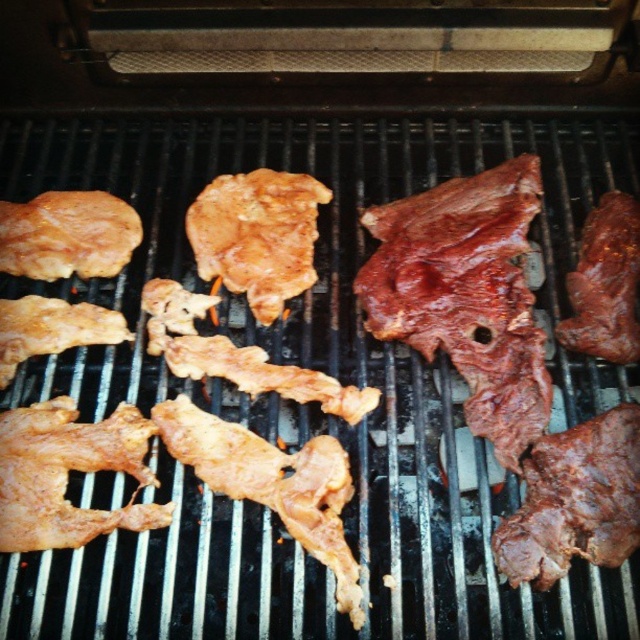
Does dark brown charred steak at right appear over brown matte chicken at center?

Actually, dark brown charred steak at right is below brown matte chicken at center.

Identify the location of dark brown charred steak at right. coord(467,294).

What do you see at coordinates (257, 236) in the screenshot?
I see `brown matte chicken at center` at bounding box center [257, 236].

Does brown matte chicken at center have a greater height compared to shiny brown meat at right?

In fact, brown matte chicken at center may be shorter than shiny brown meat at right.

The image size is (640, 640). Identify the location of brown matte chicken at center. (257, 236).

Does golden brown crispy chicken wing at center have a lesser width compared to golden brown crispy chicken wing at upper left?

Incorrect, golden brown crispy chicken wing at center's width is not less than golden brown crispy chicken wing at upper left's.

Is golden brown crispy chicken wing at center to the left of golden brown crispy chicken wing at upper left from the viewer's perspective?

Incorrect, golden brown crispy chicken wing at center is not on the left side of golden brown crispy chicken wing at upper left.

Which is behind, point (209, 452) or point (3, 243)?

Point (3, 243)

In order to click on golden brown crispy chicken wing at center in this screenshot , I will do `click(273, 483)`.